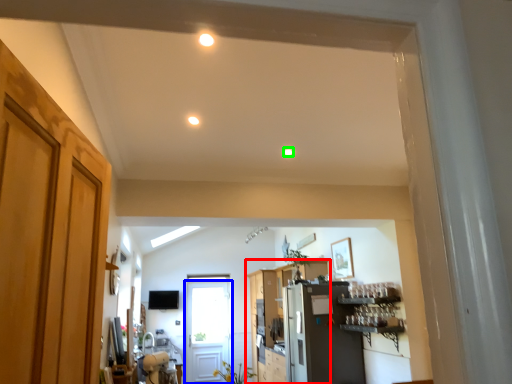
Question: Considering the real-world distances, which object is farthest from cabinetry (highlighted by a red box)? door (highlighted by a blue box) or lighting (highlighted by a green box)?

Choices:
 (A) door
 (B) lighting

Answer: (B)